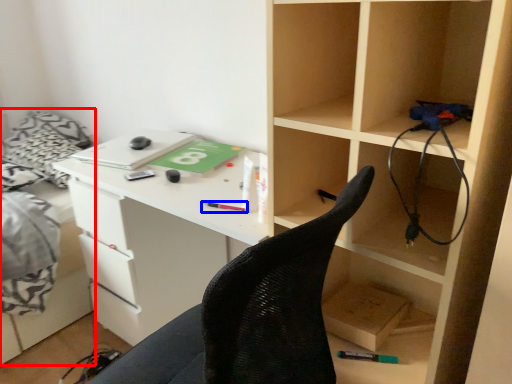
Question: Which of the following is the closest to the observer, bed (highlighted by a red box) or stationery (highlighted by a blue box)?

Choices:
 (A) bed
 (B) stationery

Answer: (B)